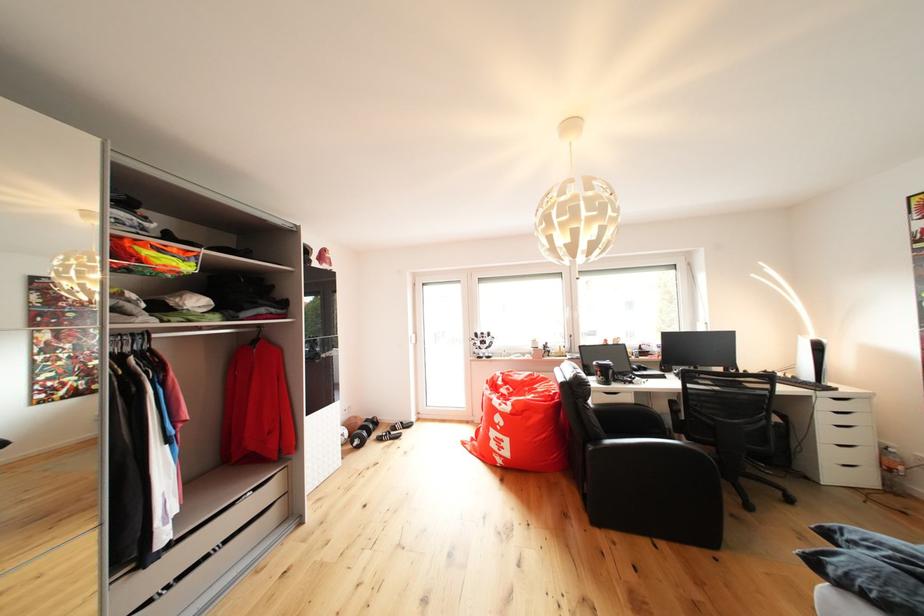
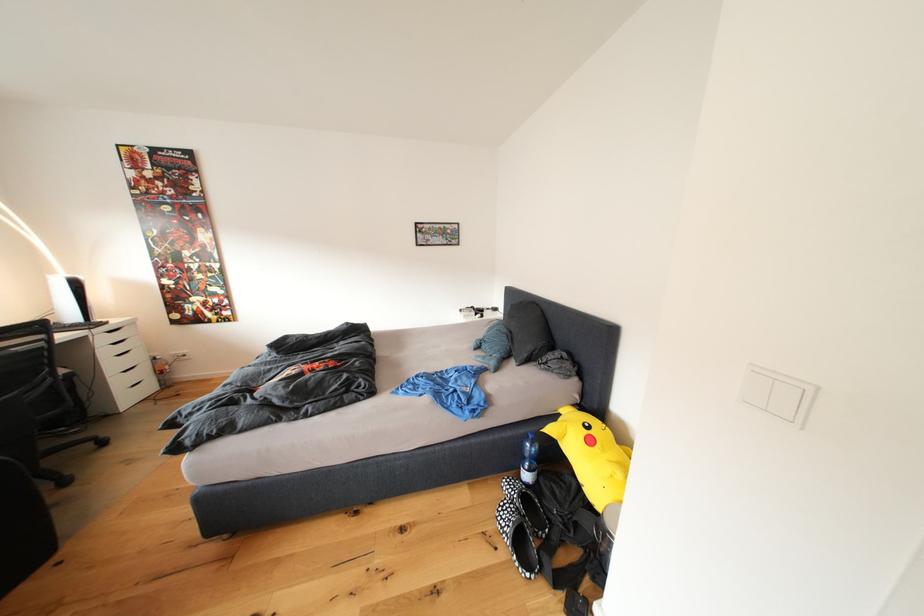
The point at (872, 464) is marked in the first image. Where is the corresponding point in the second image?

(152, 379)